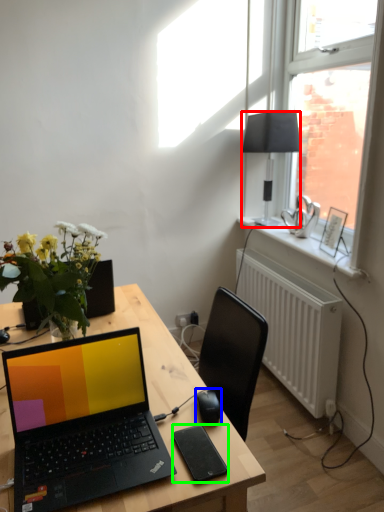
Question: Considering the real-world distances, which object is farthest from lamp (highlighted by a red box)? computer mouse (highlighted by a blue box) or tablet computer (highlighted by a green box)?

Choices:
 (A) computer mouse
 (B) tablet computer

Answer: (B)